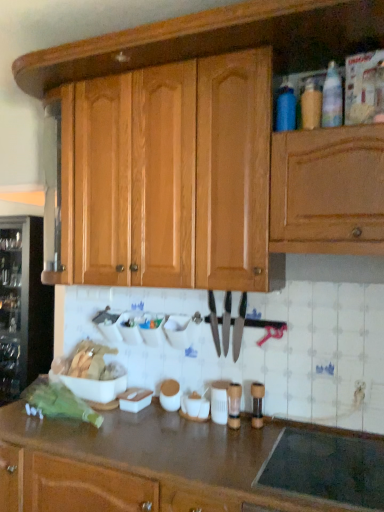
Question: Could you tell me if transparent glass wine cooler at left is turned towards black glass stovetop at lower right?

Choices:
 (A) yes
 (B) no

Answer: (B)

Question: Is transparent glass wine cooler at left facing away from black glass stovetop at lower right?

Choices:
 (A) yes
 (B) no

Answer: (B)

Question: Is transparent glass wine cooler at left completely or partially outside of black glass stovetop at lower right?

Choices:
 (A) no
 (B) yes

Answer: (B)

Question: Is transparent glass wine cooler at left bigger than black glass stovetop at lower right?

Choices:
 (A) no
 (B) yes

Answer: (B)

Question: From a real-world perspective, is transparent glass wine cooler at left positioned over black glass stovetop at lower right based on gravity?

Choices:
 (A) yes
 (B) no

Answer: (A)

Question: Looking at the image, does brown laminate countertop at lower center seem bigger or smaller compared to black glass stovetop at lower right?

Choices:
 (A) small
 (B) big

Answer: (B)

Question: From a real-world perspective, is brown laminate countertop at lower center physically located above or below black glass stovetop at lower right?

Choices:
 (A) above
 (B) below

Answer: (B)

Question: Is brown laminate countertop at lower center taller or shorter than black glass stovetop at lower right?

Choices:
 (A) short
 (B) tall

Answer: (B)

Question: In terms of width, does brown laminate countertop at lower center look wider or thinner when compared to black glass stovetop at lower right?

Choices:
 (A) wide
 (B) thin

Answer: (A)

Question: Would you say translucent plastic bottle at upper right, the 2th bottle in the left-to-right sequence, is to the left or to the right of black metallic knife at center, which appears as the first knife when viewed from the right, in the picture?

Choices:
 (A) left
 (B) right

Answer: (B)

Question: Is translucent plastic bottle at upper right, the 2th bottle in the left-to-right sequence, taller or shorter than black metallic knife at center, the 2th knife in the left-to-right sequence?

Choices:
 (A) tall
 (B) short

Answer: (B)

Question: Is translucent plastic bottle at upper right, the 2th bottle in the left-to-right sequence, spatially inside black metallic knife at center, which appears as the first knife when viewed from the right, or outside of it?

Choices:
 (A) outside
 (B) inside

Answer: (A)

Question: From a real-world perspective, relative to black metallic knife at center, which appears as the first knife when viewed from the right, is translucent plastic bottle at upper right, the 2th bottle in the left-to-right sequence, vertically above or below?

Choices:
 (A) above
 (B) below

Answer: (A)

Question: From a real-world perspective, is wooden cabinet at upper center positioned above or below blue matte bottle at upper right, acting as the third bottle starting from the right?

Choices:
 (A) above
 (B) below

Answer: (B)

Question: Is point (72, 177) closer or farther from the camera than point (274, 125)?

Choices:
 (A) farther
 (B) closer

Answer: (A)